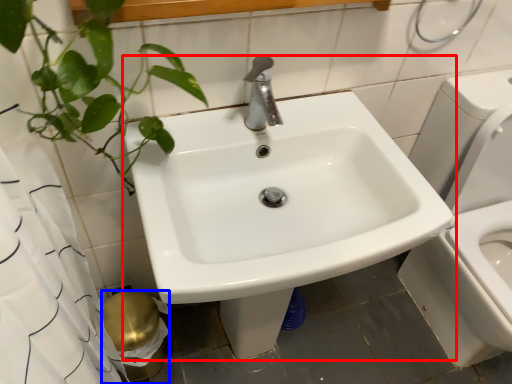
Question: Which object appears farthest to the camera in this image, sink (highlighted by a red box) or toilet paper (highlighted by a blue box)?

Choices:
 (A) sink
 (B) toilet paper

Answer: (B)